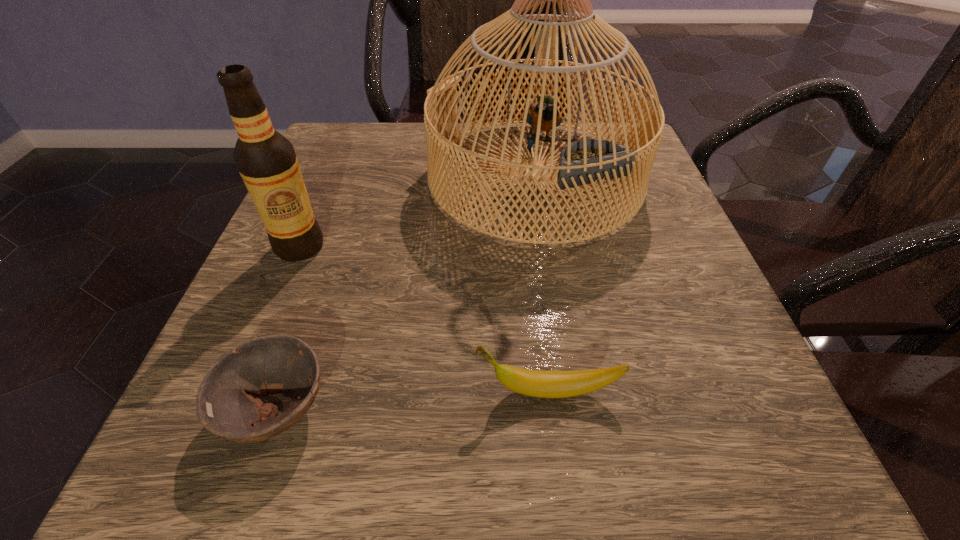
I want to click on the tallest object, so click(587, 161).

This screenshot has width=960, height=540. In order to click on alcohol in this screenshot , I will do `click(266, 160)`.

Where is `banana`? Image resolution: width=960 pixels, height=540 pixels. banana is located at coordinates (544, 384).

Locate an element on the screen. the shortest object is located at coordinates (275, 364).

Identify the location of vacant area located 0.090m on the front of the tallest object. (553, 292).

Image resolution: width=960 pixels, height=540 pixels. I want to click on free space located 0.100m on the label of the third shortest object, so click(273, 312).

Find the location of `vacant space located at the stem of the banana`. vacant space located at the stem of the banana is located at coordinates (404, 391).

Identify the location of free space located 0.330m at the stem of the banana. (212, 391).

Find the location of a particular element. The height and width of the screenshot is (540, 960). blank space located at the stem of the banana is located at coordinates (380, 391).

Locate an element on the screen. The width and height of the screenshot is (960, 540). free space located on the right of the shortest object is located at coordinates (562, 409).